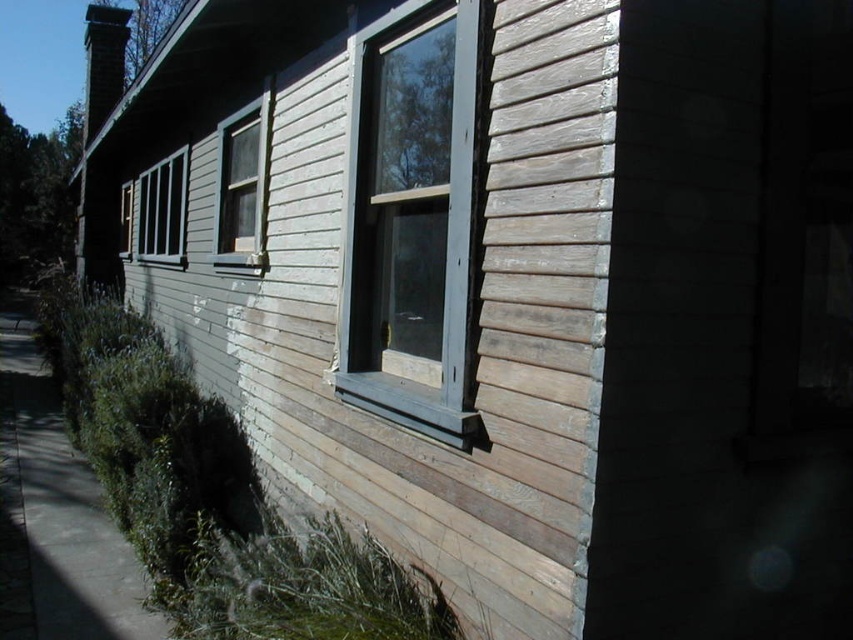
Between wooden frame window at center and clear glass window at left, which one is positioned lower?

Positioned lower is wooden frame window at center.

Looking at this image, can you confirm if wooden frame window at center is wider than clear glass window at left?

No.

Locate an element on the screen. wooden frame window at center is located at coordinates (410, 220).

Find the location of `wooden frame window at center`. wooden frame window at center is located at coordinates (410, 220).

Between point (253, 227) and point (125, 237), which one is positioned in front?

Point (253, 227) is in front.

Is point (262, 152) behind point (119, 234)?

No, (262, 152) is in front of (119, 234).

Where is `clear glass window at upper left`? The height and width of the screenshot is (640, 853). clear glass window at upper left is located at coordinates (242, 186).

Is wooden frame window at center wider than clear glass window at upper left?

Incorrect, wooden frame window at center's width does not surpass clear glass window at upper left's.

The width and height of the screenshot is (853, 640). I want to click on wooden frame window at center, so click(410, 220).